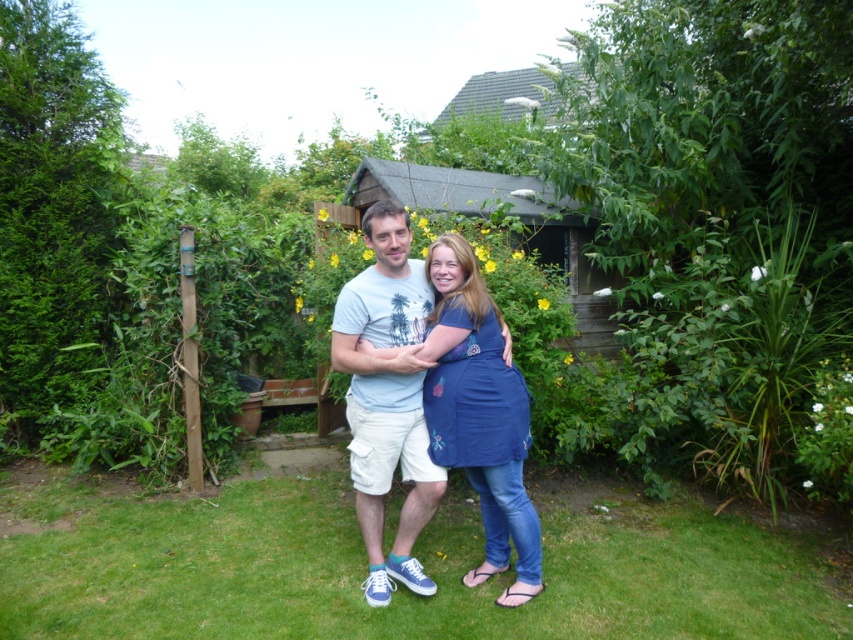
You are planning to place a picnic basket on the green grass at lower center. However, you also have a blue cotton apron at center that you want to lay out. Considering their sizes, which one can accommodate a larger item?

The green grass at lower center has a larger width than the blue cotton apron at center, so it can accommodate a larger item.